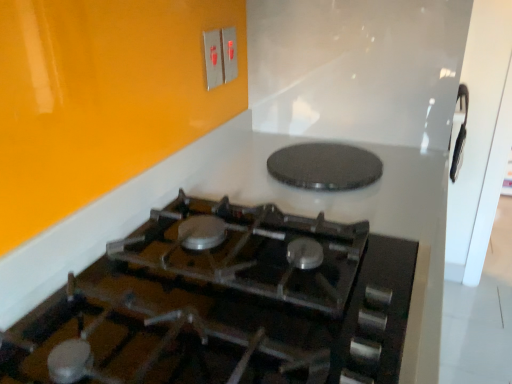
Question: Is metallic silver switch at upper center, marked as the 2th electric outlet in a left-to-right arrangement, oriented towards black glass gas stove at center?

Choices:
 (A) no
 (B) yes

Answer: (A)

Question: Can you confirm if metallic silver switch at upper center, marked as the 2th electric outlet in a left-to-right arrangement, is shorter than black glass gas stove at center?

Choices:
 (A) yes
 (B) no

Answer: (B)

Question: Is metallic silver switch at upper center, marked as the 2th electric outlet in a left-to-right arrangement, bigger than black glass gas stove at center?

Choices:
 (A) no
 (B) yes

Answer: (A)

Question: Are metallic silver switch at upper center, marked as the 2th electric outlet in a left-to-right arrangement, and black glass gas stove at center located far from each other?

Choices:
 (A) yes
 (B) no

Answer: (B)

Question: From the image's perspective, is metallic silver switch at upper center, placed as the 1th electric outlet when sorted from right to left, under black glass gas stove at center?

Choices:
 (A) no
 (B) yes

Answer: (A)

Question: Would you say metallic silver switch at upper center, placed as the 1th electric outlet when sorted from right to left, contains black glass gas stove at center?

Choices:
 (A) no
 (B) yes

Answer: (A)

Question: From a real-world perspective, is metallic switch at upper center, which is the 2th electric outlet from right to left, located beneath black glass gas stove at center?

Choices:
 (A) no
 (B) yes

Answer: (A)

Question: Considering the relative sizes of metallic switch at upper center, which is counted as the first electric outlet, starting from the left, and black glass gas stove at center in the image provided, is metallic switch at upper center, which is counted as the first electric outlet, starting from the left, wider than black glass gas stove at center?

Choices:
 (A) yes
 (B) no

Answer: (B)

Question: From a real-world perspective, is metallic switch at upper center, which is the 2th electric outlet from right to left, physically above black glass gas stove at center?

Choices:
 (A) yes
 (B) no

Answer: (A)

Question: Can you confirm if metallic switch at upper center, which is counted as the first electric outlet, starting from the left, is positioned to the left of black glass gas stove at center?

Choices:
 (A) yes
 (B) no

Answer: (A)

Question: Is metallic switch at upper center, which is the 2th electric outlet from right to left, positioned beyond the bounds of black glass gas stove at center?

Choices:
 (A) yes
 (B) no

Answer: (A)

Question: Is metallic switch at upper center, which is the 2th electric outlet from right to left, oriented towards black glass gas stove at center?

Choices:
 (A) yes
 (B) no

Answer: (B)

Question: Is black textured pizza pan at upper center positioned in front of black glass gas stove at center?

Choices:
 (A) no
 (B) yes

Answer: (A)